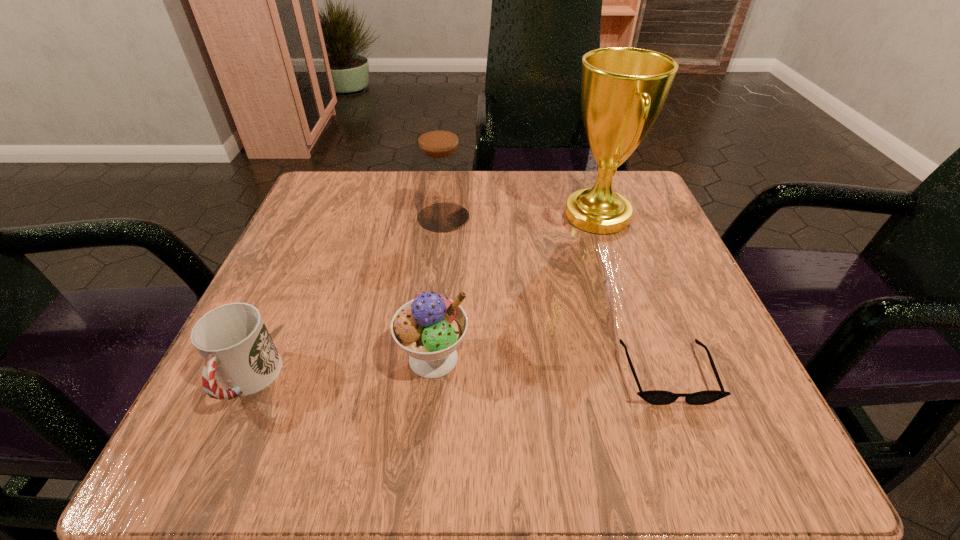
In order to click on free space located on the right of the icecream in this screenshot , I will do `click(613, 358)`.

Where is `vacant area situated on the handle side of the leftmost object`? vacant area situated on the handle side of the leftmost object is located at coordinates (212, 458).

The height and width of the screenshot is (540, 960). What are the coordinates of `vacant area located 0.060m on the front-facing side of the shortest object` in the screenshot? It's located at (694, 449).

Identify the location of award that is at the far edge. (623, 89).

The height and width of the screenshot is (540, 960). What are the coordinates of `jar at the far edge` in the screenshot? It's located at (440, 173).

The height and width of the screenshot is (540, 960). Find the location of `cup located in the near edge section of the desktop`. cup located in the near edge section of the desktop is located at coordinates (233, 341).

Locate an element on the screen. The width and height of the screenshot is (960, 540). sunglasses present at the near edge is located at coordinates (656, 397).

In order to click on object at the left edge in this screenshot , I will do `click(233, 341)`.

This screenshot has height=540, width=960. What are the coordinates of `award that is positioned at the right edge` in the screenshot? It's located at (623, 89).

Where is `sunglasses that is at the right edge`? Image resolution: width=960 pixels, height=540 pixels. sunglasses that is at the right edge is located at coordinates [x=656, y=397].